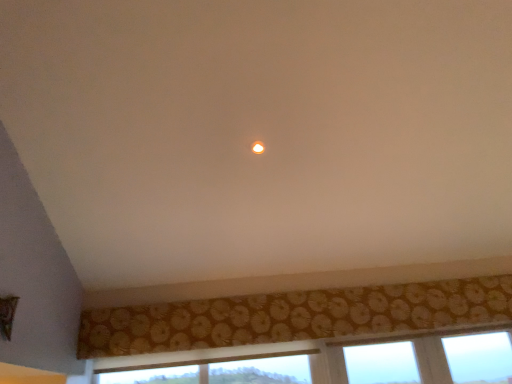
Locate an element on the screen. matte yellow light at center is located at coordinates tap(258, 147).

Describe the element at coordinates (258, 147) in the screenshot. I see `matte yellow light at center` at that location.

From the picture: Measure the distance between point (500, 307) and camera.

They are 2.84 meters apart.

Describe the element at coordinates (294, 316) in the screenshot. I see `gold textured curtain at lower center` at that location.

What is the approximate width of gold textured curtain at lower center?

3.17 inches.

Identify the location of gold textured curtain at lower center. (294, 316).

Find the location of `matte yellow light at center`. matte yellow light at center is located at coordinates (258, 147).

In the image, is matte yellow light at center on the left side or the right side of gold textured curtain at lower center?

matte yellow light at center is positioned on gold textured curtain at lower center's left side.

Does matte yellow light at center come behind gold textured curtain at lower center?

That is False.

Which point is more distant from viewer, (254, 144) or (437, 281)?

The point (437, 281) is more distant.

From the image's perspective, is matte yellow light at center above gold textured curtain at lower center?

Yes, from the image's perspective, matte yellow light at center is on top of gold textured curtain at lower center.

From a real-world perspective, is matte yellow light at center on top of gold textured curtain at lower center?

Yes, from a real-world perspective, matte yellow light at center is above gold textured curtain at lower center.

Is matte yellow light at center wider or thinner than gold textured curtain at lower center?

In the image, matte yellow light at center appears to be wider than gold textured curtain at lower center.

Which of these two, matte yellow light at center or gold textured curtain at lower center, stands shorter?

matte yellow light at center is shorter.

Between matte yellow light at center and gold textured curtain at lower center, which one has smaller size?

matte yellow light at center is smaller.

Is matte yellow light at center outside of gold textured curtain at lower center?

Indeed, matte yellow light at center is completely outside gold textured curtain at lower center.

Can you see matte yellow light at center touching gold textured curtain at lower center?

No.

Does matte yellow light at center turn towards gold textured curtain at lower center?

No, matte yellow light at center is not facing towards gold textured curtain at lower center.

Locate an element on the screen. Image resolution: width=512 pixels, height=384 pixels. glow in front of the gold textured curtain at lower center is located at coordinates (258, 147).

Between gold textured curtain at lower center and matte yellow light at center, which one appears on the right side from the viewer's perspective?

From the viewer's perspective, gold textured curtain at lower center appears more on the right side.

Is gold textured curtain at lower center further to camera compared to matte yellow light at center?

Yes, gold textured curtain at lower center is behind matte yellow light at center.

Between point (332, 320) and point (256, 152), which one is positioned in front?

Positioned in front is point (256, 152).

From the image's perspective, is gold textured curtain at lower center above or below matte yellow light at center?

gold textured curtain at lower center is situated lower than matte yellow light at center in the image.

From a real-world perspective, between gold textured curtain at lower center and matte yellow light at center, who is vertically lower?

gold textured curtain at lower center.

Does gold textured curtain at lower center have a greater width compared to matte yellow light at center?

No, gold textured curtain at lower center is not wider than matte yellow light at center.

Who is shorter, gold textured curtain at lower center or matte yellow light at center?

Standing shorter between the two is matte yellow light at center.

Is gold textured curtain at lower center smaller than matte yellow light at center?

Incorrect, gold textured curtain at lower center is not smaller in size than matte yellow light at center.

Is matte yellow light at center located within gold textured curtain at lower center?

No, matte yellow light at center is located outside of gold textured curtain at lower center.

Is gold textured curtain at lower center not near matte yellow light at center?

gold textured curtain at lower center is positioned a significant distance from matte yellow light at center.

Is gold textured curtain at lower center facing away from matte yellow light at center?

gold textured curtain at lower center does not have its back to matte yellow light at center.

In the scene shown: Measure the distance between gold textured curtain at lower center and matte yellow light at center.

A distance of 1.41 meters exists between gold textured curtain at lower center and matte yellow light at center.

Where is `glow above the gold textured curtain at lower center (from a real-world perspective)`? The image size is (512, 384). glow above the gold textured curtain at lower center (from a real-world perspective) is located at coordinates (258, 147).

The width and height of the screenshot is (512, 384). Identify the location of glow that appears in front of the gold textured curtain at lower center. (258, 147).

Locate an element on the screen. The height and width of the screenshot is (384, 512). curtain located on the right of matte yellow light at center is located at coordinates (294, 316).